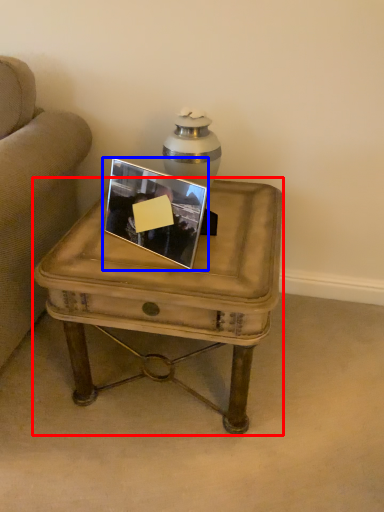
Question: Which object is further to the camera taking this photo, coffee table (highlighted by a red box) or picture frame (highlighted by a blue box)?

Choices:
 (A) coffee table
 (B) picture frame

Answer: (B)